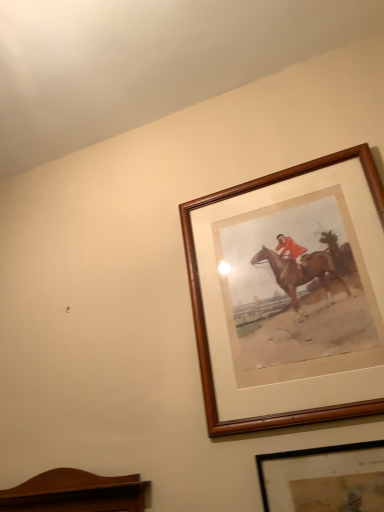
Question: Does wooden picture frame at upper right, which appears as the 1th picture frame when viewed from the top, have a larger size compared to black matte picture frame at lower right, positioned as the first picture frame in bottom-to-top order?

Choices:
 (A) no
 (B) yes

Answer: (B)

Question: Considering the relative sizes of wooden picture frame at upper right, which appears as the 1th picture frame when viewed from the top, and black matte picture frame at lower right, positioned as the first picture frame in bottom-to-top order, in the image provided, is wooden picture frame at upper right, which appears as the 1th picture frame when viewed from the top, shorter than black matte picture frame at lower right, positioned as the first picture frame in bottom-to-top order,?

Choices:
 (A) yes
 (B) no

Answer: (B)

Question: Could you tell me if wooden picture frame at upper right, positioned as the second picture frame in bottom-to-top order, is turned towards black matte picture frame at lower right, acting as the 2th picture frame starting from the top?

Choices:
 (A) yes
 (B) no

Answer: (B)

Question: From the image's perspective, is wooden picture frame at upper right, positioned as the second picture frame in bottom-to-top order, beneath black matte picture frame at lower right, acting as the 2th picture frame starting from the top?

Choices:
 (A) yes
 (B) no

Answer: (B)

Question: Is wooden picture frame at upper right, which appears as the 1th picture frame when viewed from the top, smaller than black matte picture frame at lower right, positioned as the first picture frame in bottom-to-top order?

Choices:
 (A) yes
 (B) no

Answer: (B)

Question: Is wooden picture frame at upper right, which appears as the 1th picture frame when viewed from the top, at the left side of black matte picture frame at lower right, acting as the 2th picture frame starting from the top?

Choices:
 (A) yes
 (B) no

Answer: (A)

Question: Is black matte picture frame at lower right, positioned as the first picture frame in bottom-to-top order, thinner than wooden picture frame at upper right, positioned as the second picture frame in bottom-to-top order?

Choices:
 (A) no
 (B) yes

Answer: (B)

Question: Could you tell me if black matte picture frame at lower right, positioned as the first picture frame in bottom-to-top order, is turned towards wooden picture frame at upper right, which appears as the 1th picture frame when viewed from the top?

Choices:
 (A) yes
 (B) no

Answer: (B)

Question: Is black matte picture frame at lower right, positioned as the first picture frame in bottom-to-top order, to the left of wooden picture frame at upper right, positioned as the second picture frame in bottom-to-top order, from the viewer's perspective?

Choices:
 (A) no
 (B) yes

Answer: (A)

Question: From the image's perspective, is black matte picture frame at lower right, positioned as the first picture frame in bottom-to-top order, beneath wooden picture frame at upper right, positioned as the second picture frame in bottom-to-top order?

Choices:
 (A) no
 (B) yes

Answer: (B)

Question: From a real-world perspective, is black matte picture frame at lower right, positioned as the first picture frame in bottom-to-top order, located higher than wooden picture frame at upper right, which appears as the 1th picture frame when viewed from the top?

Choices:
 (A) no
 (B) yes

Answer: (A)

Question: Considering the relative positions of black matte picture frame at lower right, positioned as the first picture frame in bottom-to-top order, and wooden picture frame at upper right, positioned as the second picture frame in bottom-to-top order, in the image provided, is black matte picture frame at lower right, positioned as the first picture frame in bottom-to-top order, to the right of wooden picture frame at upper right, positioned as the second picture frame in bottom-to-top order, from the viewer's perspective?

Choices:
 (A) no
 (B) yes

Answer: (B)

Question: Considering the positions of black matte picture frame at lower right, positioned as the first picture frame in bottom-to-top order, and wooden picture frame at upper right, which appears as the 1th picture frame when viewed from the top, in the image, is black matte picture frame at lower right, positioned as the first picture frame in bottom-to-top order, wider or thinner than wooden picture frame at upper right, which appears as the 1th picture frame when viewed from the top,?

Choices:
 (A) wide
 (B) thin

Answer: (B)